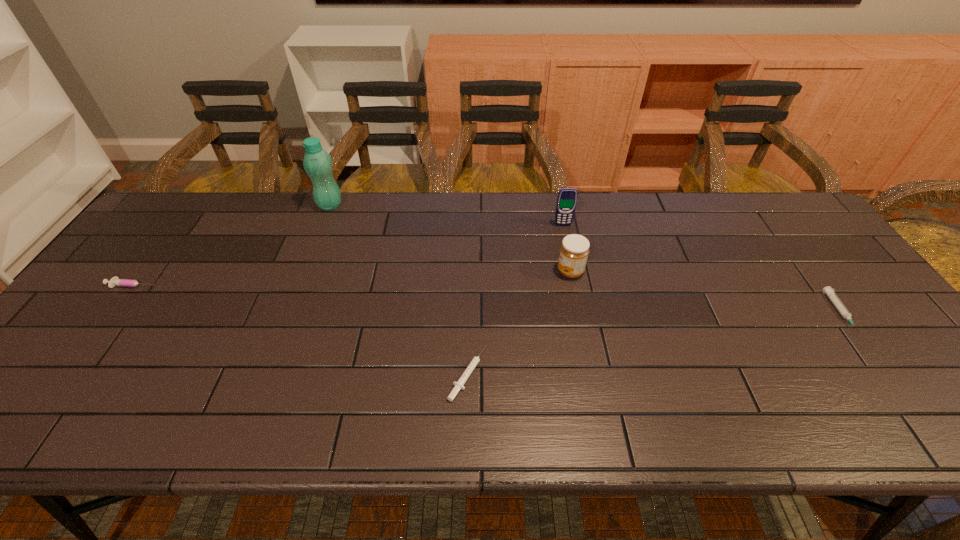
Identify the location of object identified as the fifth closest to the jam. Image resolution: width=960 pixels, height=540 pixels. coord(115,281).

At what (x,y) coordinates should I click in order to perform the action: click on the closest syringe to the rightmost object. Please return your answer as a coordinate pair (x, y). This screenshot has width=960, height=540. Looking at the image, I should click on (459, 384).

Identify which syringe is the nearest to the farthest syringe. Please provide its 2D coordinates. Your answer should be formatted as a tuple, i.e. [(x, y)], where the tuple contains the x and y coordinates of a point satisfying the conditions above.

[(459, 384)]

The height and width of the screenshot is (540, 960). I want to click on free point that satisfies the following two spatial constraints: 1. on the front side of the fourth object from right to left; 2. on the right side of the bottle, so click(x=264, y=374).